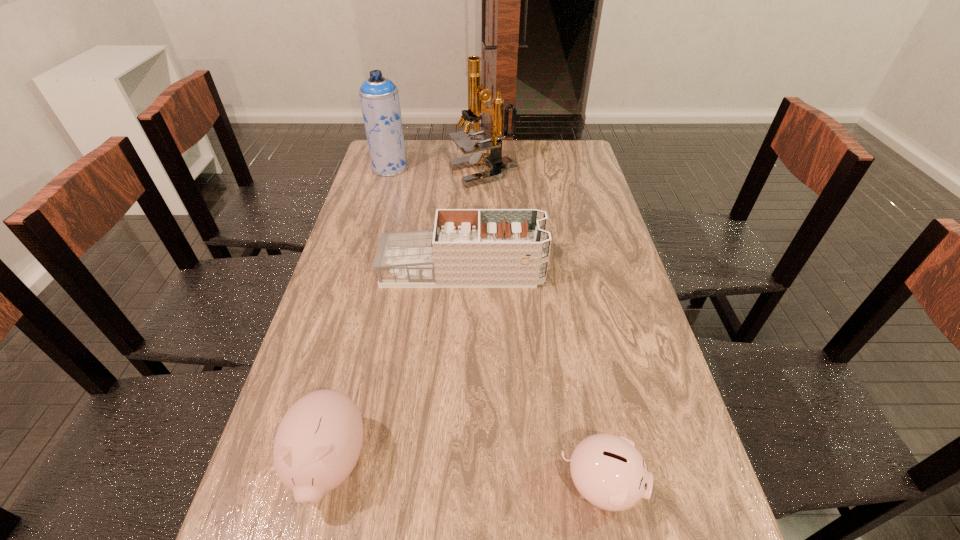
Find the location of a particular element. This screenshot has width=960, height=540. free location located 0.070m at the entrance of the dollhouse is located at coordinates (567, 271).

Locate an element on the screen. blank area located 0.180m on the left of the right piggy bank is located at coordinates (466, 486).

You are a GUI agent. You are given a task and a screenshot of the screen. Output one action in this format:
    pyautogui.click(x=<x>, y=<y>)
    Task: Click on the microscope present at the far edge
    The height and width of the screenshot is (540, 960).
    Given the screenshot: What is the action you would take?
    pyautogui.click(x=477, y=95)

Identify the location of aerosol can positioned at the far edge. (379, 98).

Locate an element on the screen. aerosol can that is at the left edge is located at coordinates (379, 98).

Find the location of a particular element. The image size is (960, 540). dollhouse that is at the left edge is located at coordinates (468, 248).

I want to click on piggy bank at the left edge, so click(x=318, y=442).

You are a GUI agent. You are given a task and a screenshot of the screen. Output one action in this format:
    pyautogui.click(x=<x>, y=<y>)
    Task: Click on the object that is at the right edge
    The image size is (960, 540).
    Given the screenshot: What is the action you would take?
    pyautogui.click(x=609, y=472)

This screenshot has height=540, width=960. I want to click on object at the far left corner, so click(379, 98).

The height and width of the screenshot is (540, 960). What are the coordinates of `blank space at the far edge of the desktop` in the screenshot? It's located at (530, 150).